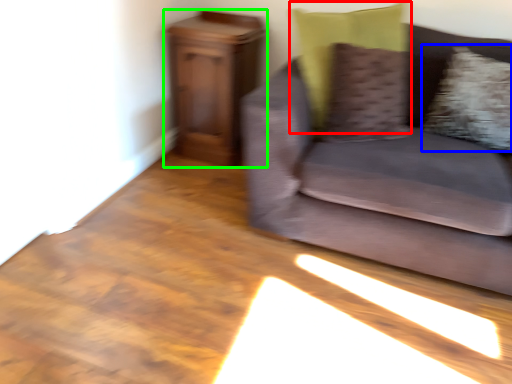
Question: Estimate the real-world distances between objects in this image. Which object is farther from pillow (highlighted by a red box), pillow (highlighted by a blue box) or furniture (highlighted by a green box)?

Choices:
 (A) pillow
 (B) furniture

Answer: (B)